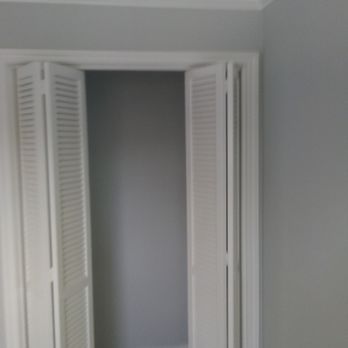
Find the location of `wall (to left of closet)`. wall (to left of closet) is located at coordinates (2, 315).